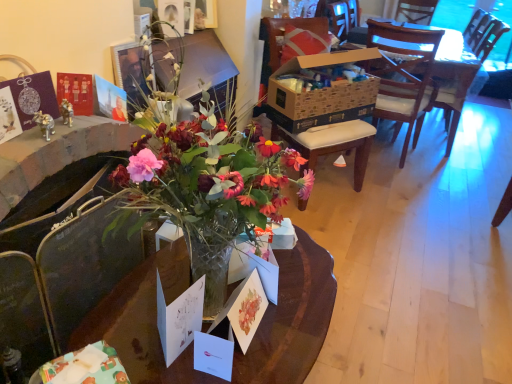
Locate an element on the screen. vacant space that is to the left of white paper postcard at center, which is the 1th postcard from left to right is located at coordinates (128, 323).